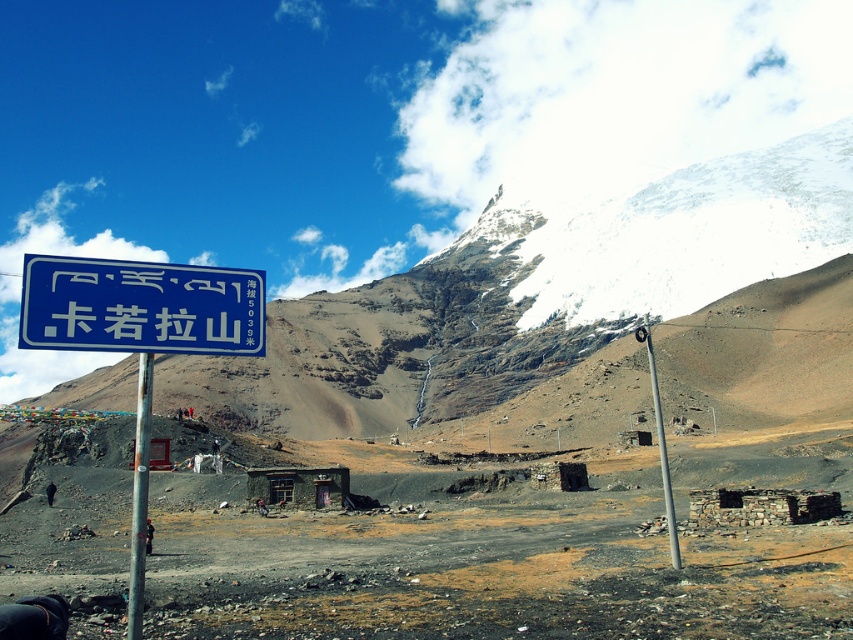
Question: Observing the image, what is the correct spatial positioning of blue plastic sign at center in reference to metallic pole at left?

Choices:
 (A) above
 (B) below

Answer: (A)

Question: Which object appears closest to the camera in this image?

Choices:
 (A) metallic pole at left
 (B) blue plastic sign at center

Answer: (B)

Question: Does metallic pole at left appear over dark brown stone hut at center?

Choices:
 (A) no
 (B) yes

Answer: (B)

Question: Which object appears closest to the camera in this image?

Choices:
 (A) dark brown stone hut at center
 (B) metallic pole at right

Answer: (B)

Question: Observing the image, what is the correct spatial positioning of blue plastic sign at center in reference to metallic pole at right?

Choices:
 (A) above
 (B) below

Answer: (A)

Question: Which object is closer to the camera taking this photo?

Choices:
 (A) metallic pole at right
 (B) white snow-covered mountain at upper center
 (C) dark brown stone hut at center

Answer: (A)